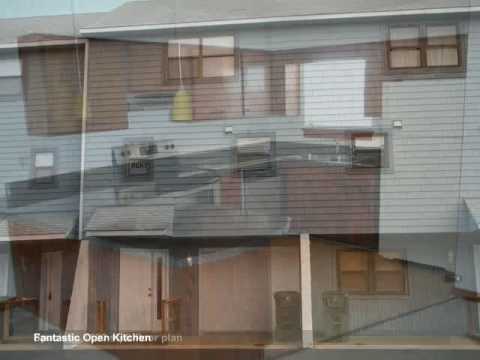
Find the location of a particular element. kitchen storage space is located at coordinates (62, 92), (101, 82), (150, 73), (211, 88), (264, 93), (240, 100).